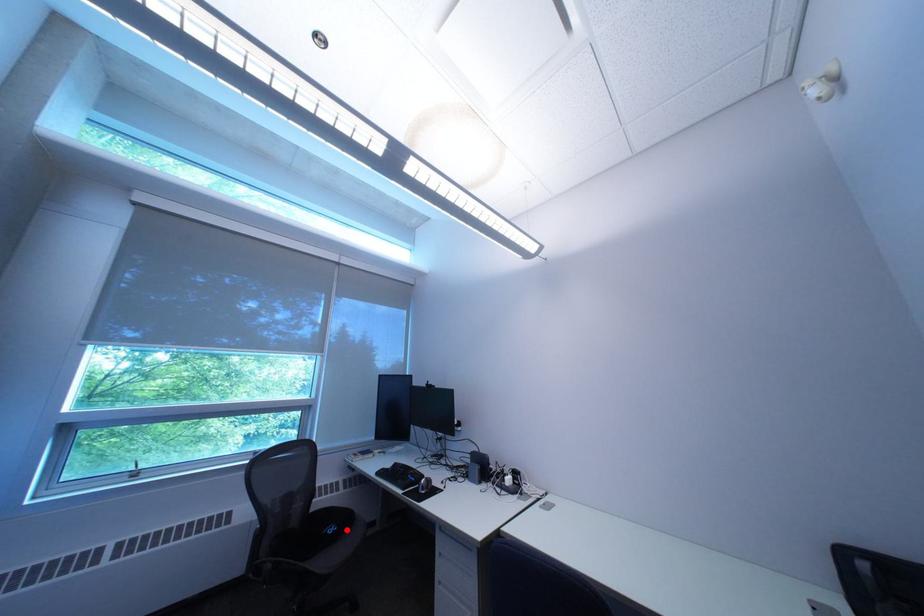
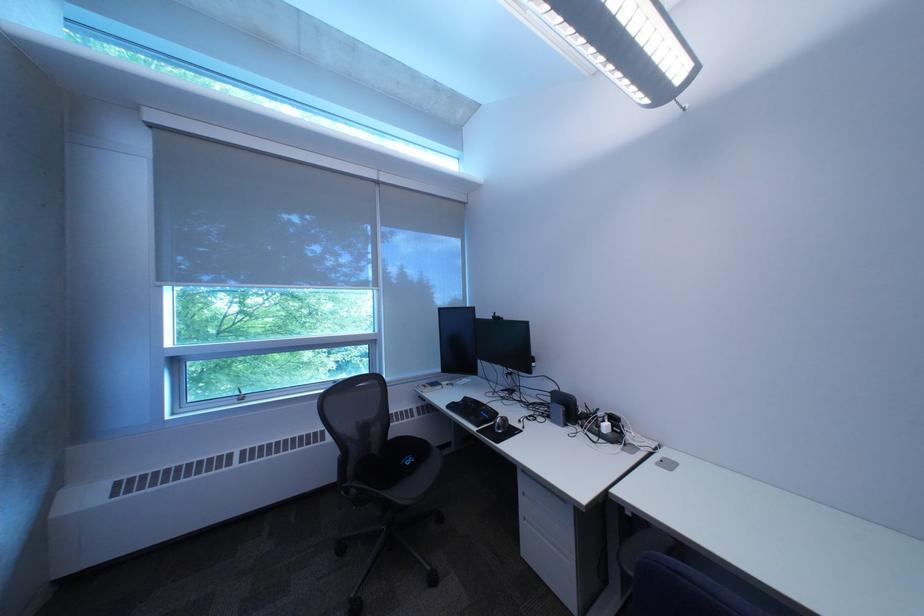
Where in the second image is the point corresponding to the highlighted location from the first image?

(423, 461)